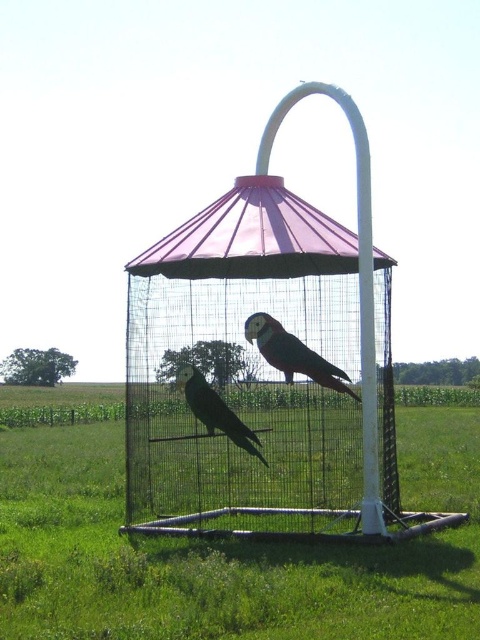
Is multicolored feathered parrot at center positioned before black matte parrot at center?

No, multicolored feathered parrot at center is behind black matte parrot at center.

Does multicolored feathered parrot at center have a greater height compared to black matte parrot at center?

No, multicolored feathered parrot at center is not taller than black matte parrot at center.

Identify the location of multicolored feathered parrot at center. (292, 353).

Who is lower down, pink mesh birdcage at center or black matte parrot at center?

black matte parrot at center is lower down.

This screenshot has height=640, width=480. Find the location of `pink mesh birdcage at center`. pink mesh birdcage at center is located at coordinates (262, 362).

Find the location of `pink mesh birdcage at center`. pink mesh birdcage at center is located at coordinates (262, 362).

Identify the location of pink mesh birdcage at center. The width and height of the screenshot is (480, 640). (262, 362).

Who is positioned more to the right, green grass at center or multicolored feathered parrot at center?

multicolored feathered parrot at center

Locate an element on the screen. This screenshot has height=640, width=480. green grass at center is located at coordinates (228, 552).